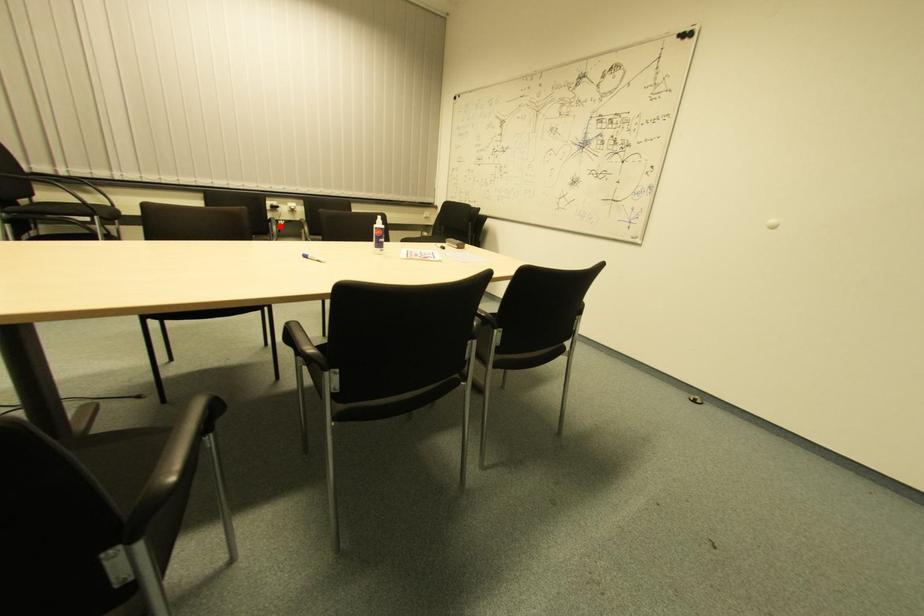
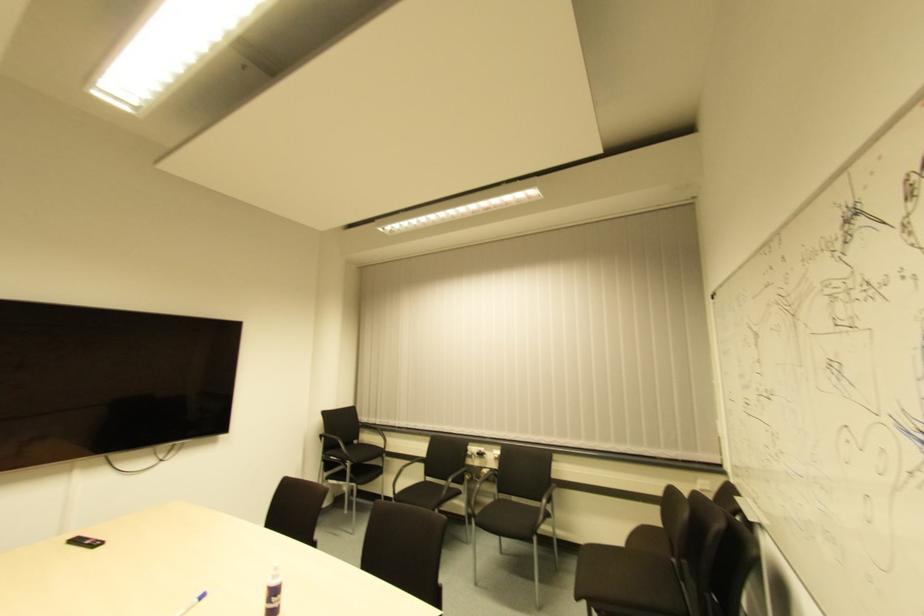
Question: I am providing you with two images of the same scene from different viewpoints. Given a red point in image1, look at the same physical point in image2. Is it:

Choices:
 (A) Closer to the viewpoint
 (B) Farther from the viewpoint

Answer: (B)